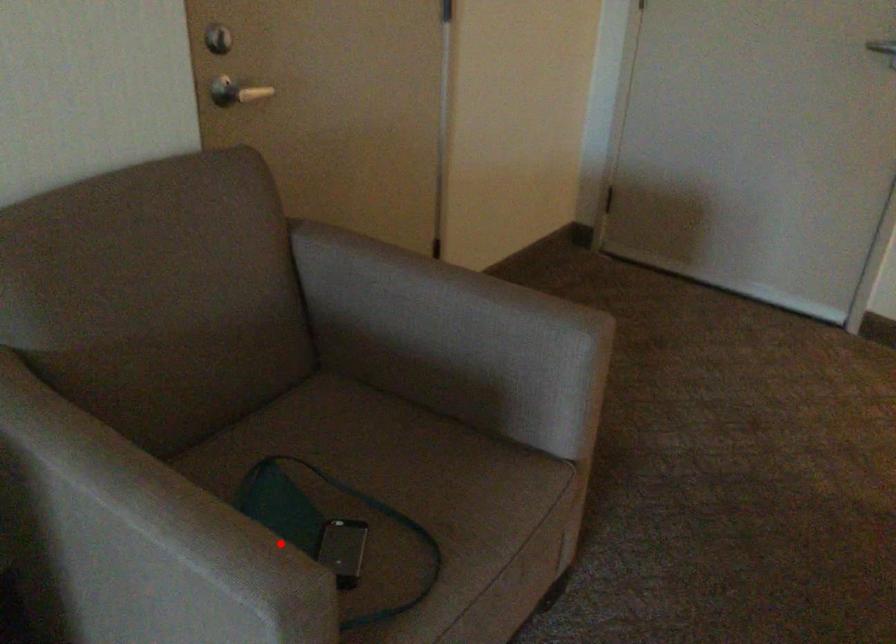
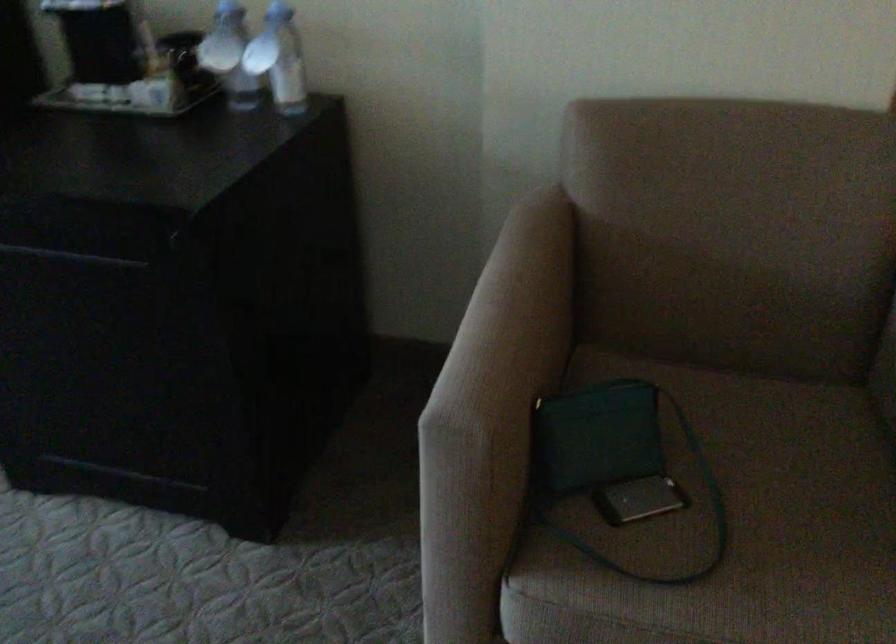
Question: I am providing you with two images of the same scene from different viewpoints. Given a red point in image1, look at the same physical point in image2. Is it:

Choices:
 (A) Closer to the viewpoint
 (B) Farther from the viewpoint

Answer: (B)